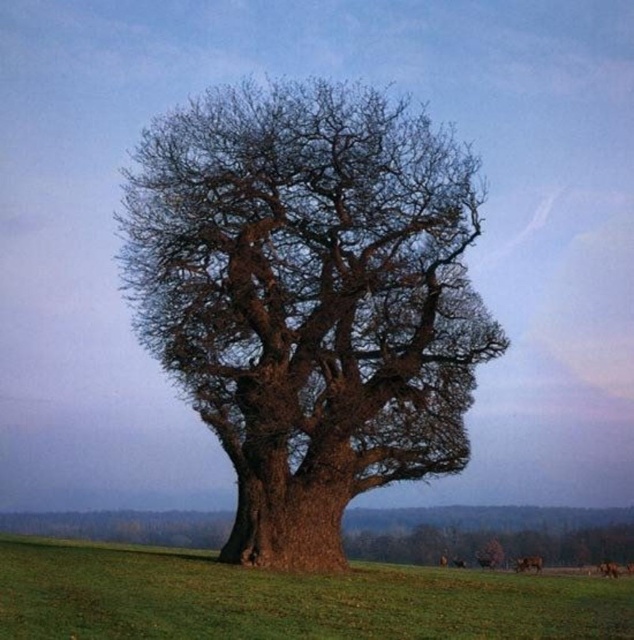
Who is more forward, (448, 285) or (184, 556)?

Point (448, 285)

Which is more to the left, brown rough bark oak tree at center or green grassy field at center?

green grassy field at center is more to the left.

Describe the element at coordinates (307, 298) in the screenshot. I see `brown rough bark oak tree at center` at that location.

You are a GUI agent. You are given a task and a screenshot of the screen. Output one action in this format:
    pyautogui.click(x=<x>, y=<y>)
    Task: Click on the brown rough bark oak tree at center
    This screenshot has height=640, width=634.
    Given the screenshot: What is the action you would take?
    pyautogui.click(x=307, y=298)

Can you confirm if green grassy field at center is taller than brown furry dog at lower right?

Correct, green grassy field at center is much taller as brown furry dog at lower right.

Measure the distance between green grassy field at center and camera.

A distance of 14.46 meters exists between green grassy field at center and camera.

Locate an element on the screen. This screenshot has width=634, height=640. green grassy field at center is located at coordinates (288, 600).

Between brown rough bark oak tree at center and brown furry dog at lower right, which one is positioned lower?

Positioned lower is brown furry dog at lower right.

Does brown rough bark oak tree at center have a smaller size compared to brown furry dog at lower right?

Incorrect, brown rough bark oak tree at center is not smaller in size than brown furry dog at lower right.

This screenshot has height=640, width=634. What are the coordinates of `brown rough bark oak tree at center` in the screenshot? It's located at (307, 298).